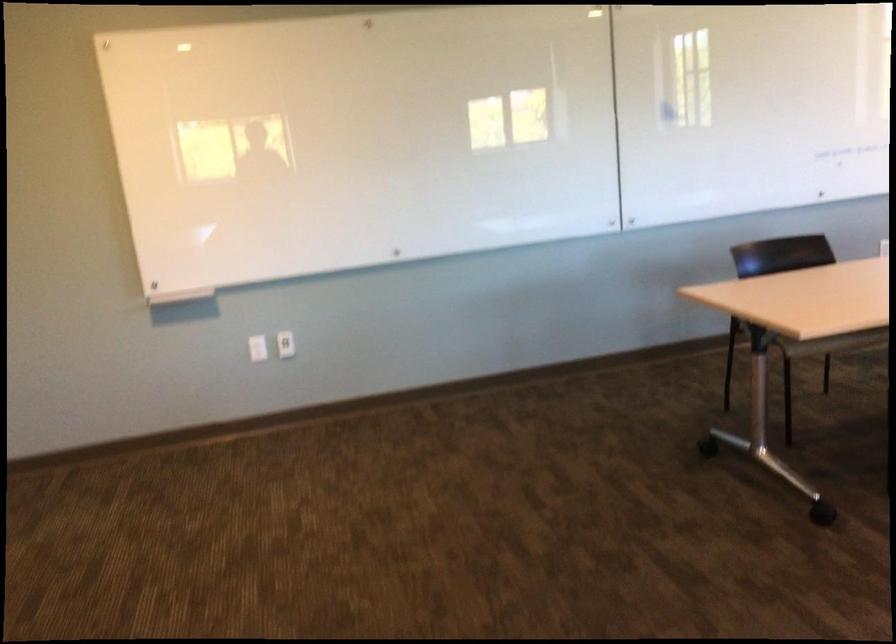
Find where to plac the whiteboard marker ledge. Please return your answer as a coordinate pair (x, y).

(175, 292)